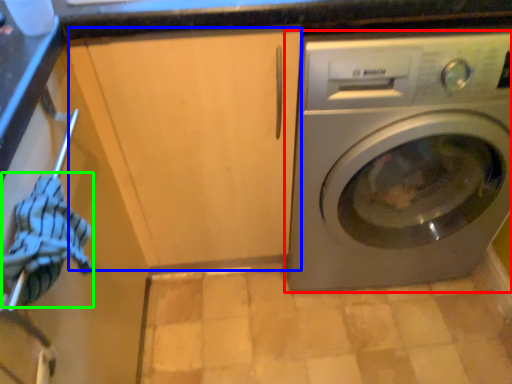
Question: Which is farther away from washing machine (highlighted by a red box)? cabinetry (highlighted by a blue box) or clothing (highlighted by a green box)?

Choices:
 (A) cabinetry
 (B) clothing

Answer: (B)